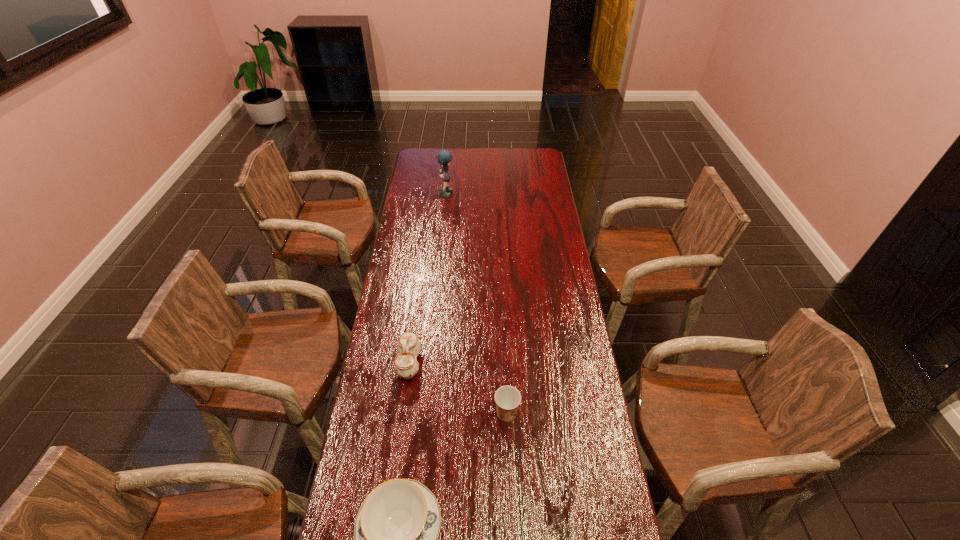
Identify which object is the third closest to the rightmost object. Please provide its 2D coordinates. Your answer should be formatted as a tuple, i.e. [(x, y)], where the tuple contains the x and y coordinates of a point satisfying the conditions above.

[(444, 157)]

Identify which object is located as the nearest to the rightmost object. Please provide its 2D coordinates. Your answer should be formatted as a tuple, i.e. [(x, y)], where the tuple contains the x and y coordinates of a point satisfying the conditions above.

[(396, 529)]

Locate an element on the screen. Image resolution: width=960 pixels, height=540 pixels. free spot that satisfies the following two spatial constraints: 1. on the back side of the Dixie cup; 2. by the handle of the second farthest object is located at coordinates (504, 363).

Where is `vacant space that satisfies the following two spatial constraints: 1. on the front-facing side of the tallest object; 2. on the back side of the second nearest object`? vacant space that satisfies the following two spatial constraints: 1. on the front-facing side of the tallest object; 2. on the back side of the second nearest object is located at coordinates (426, 413).

At what (x,y) coordinates should I click in order to perform the action: click on vacant space that satisfies the following two spatial constraints: 1. by the handle of the farther chinaware; 2. on the left side of the Dixie cup. Please return your answer as a coordinate pair (x, y). The image size is (960, 540). Looking at the image, I should click on (402, 413).

Locate an element on the screen. vacant area that satisfies the following two spatial constraints: 1. on the front-facing side of the rightmost object; 2. on the right side of the rag doll is located at coordinates (426, 413).

Where is `vacant area in the image that satisfies the following two spatial constraints: 1. on the front-facing side of the Dixie cup; 2. on the right side of the tallest object`? The height and width of the screenshot is (540, 960). vacant area in the image that satisfies the following two spatial constraints: 1. on the front-facing side of the Dixie cup; 2. on the right side of the tallest object is located at coordinates (426, 413).